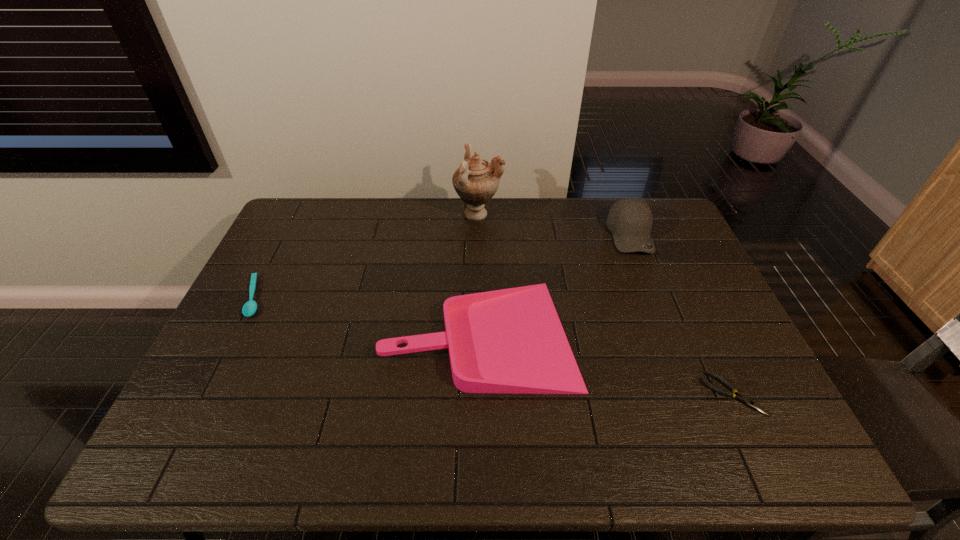
Where is `vacant area situated 0.110m on the front of the spoon`? The height and width of the screenshot is (540, 960). vacant area situated 0.110m on the front of the spoon is located at coordinates (227, 352).

The width and height of the screenshot is (960, 540). Identify the location of vacant space located on the left of the pliers. coord(627,394).

The image size is (960, 540). What are the coordinates of `urn that is at the far edge` in the screenshot? It's located at tap(476, 181).

The width and height of the screenshot is (960, 540). I want to click on baseball cap that is at the far edge, so click(630, 220).

Locate an element on the screen. object located at the left edge is located at coordinates (250, 307).

At what (x,y) coordinates should I click in order to perform the action: click on baseball cap that is positioned at the right edge. Please return your answer as a coordinate pair (x, y). The width and height of the screenshot is (960, 540). Looking at the image, I should click on (630, 220).

Where is `pliers positioned at the right edge`? pliers positioned at the right edge is located at coordinates (741, 398).

Where is `object located in the far right corner section of the desktop`? This screenshot has height=540, width=960. object located in the far right corner section of the desktop is located at coordinates (630, 220).

The height and width of the screenshot is (540, 960). In the image, there is a desktop. Identify the location of vacant area at the far edge. (562, 232).

This screenshot has height=540, width=960. Identify the location of vacant space at the near edge of the desktop. (529, 434).